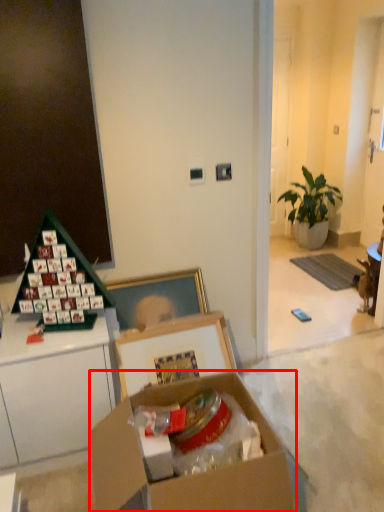
Question: From the image's perspective, what is the correct spatial positioning of box (annotated by the red box) in reference to houseplant?

Choices:
 (A) above
 (B) below

Answer: (B)